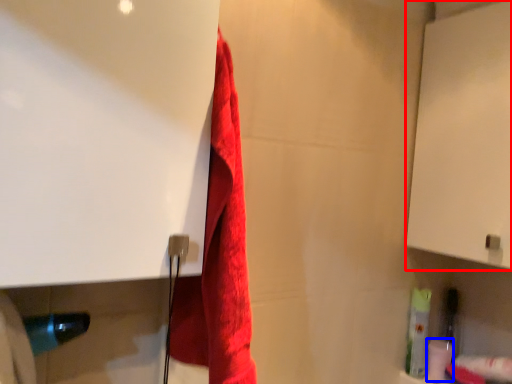
Question: Which object appears farthest to the camera in this image, screen door (highlighted by a red box) or toilet paper (highlighted by a blue box)?

Choices:
 (A) screen door
 (B) toilet paper

Answer: (B)